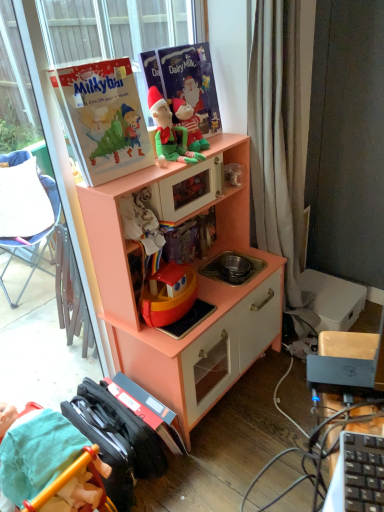
Question: Does matte paper book at upper center, which appears as the 1th paperback book when viewed from the right, lie behind peach wood toy kitchen at center?

Choices:
 (A) yes
 (B) no

Answer: (A)

Question: Is matte paper book at upper center, which is the second paperback book in left-to-right order, smaller than peach wood toy kitchen at center?

Choices:
 (A) yes
 (B) no

Answer: (A)

Question: From the image's perspective, would you say matte paper book at upper center, which is the second paperback book in left-to-right order, is positioned over peach wood toy kitchen at center?

Choices:
 (A) no
 (B) yes

Answer: (B)

Question: From a real-world perspective, is matte paper book at upper center, which is the second paperback book in left-to-right order, under peach wood toy kitchen at center?

Choices:
 (A) no
 (B) yes

Answer: (A)

Question: Considering the relative sizes of matte paper book at upper center, which appears as the 1th paperback book when viewed from the right, and peach wood toy kitchen at center in the image provided, is matte paper book at upper center, which appears as the 1th paperback book when viewed from the right, bigger than peach wood toy kitchen at center?

Choices:
 (A) no
 (B) yes

Answer: (A)

Question: Is point (147, 150) positioned closer to the camera than point (165, 115)?

Choices:
 (A) closer
 (B) farther

Answer: (A)

Question: Is matte paperboard book at upper left, arranged as the 1th paperback book when viewed from the left, wider or thinner than green plush toy at upper center, marked as the 1th person in a right-to-left arrangement?

Choices:
 (A) wide
 (B) thin

Answer: (B)

Question: Is matte paperboard book at upper left, arranged as the 1th paperback book when viewed from the left, taller or shorter than green plush toy at upper center, the 2th person from the bottom?

Choices:
 (A) tall
 (B) short

Answer: (A)

Question: Considering the relative positions of matte paperboard book at upper left, the 2th paperback book from the right, and green plush toy at upper center, which is counted as the second person, starting from the left, in the image provided, is matte paperboard book at upper left, the 2th paperback book from the right, to the left or to the right of green plush toy at upper center, which is counted as the second person, starting from the left,?

Choices:
 (A) right
 (B) left

Answer: (B)

Question: From a real-world perspective, is green plush toy at upper center, marked as the 1th person in a right-to-left arrangement, physically located above or below peach wood toy kitchen at center?

Choices:
 (A) below
 (B) above

Answer: (B)

Question: Looking at the image, does green plush toy at upper center, which is counted as the first person, starting from the top, seem bigger or smaller compared to peach wood toy kitchen at center?

Choices:
 (A) small
 (B) big

Answer: (A)

Question: Considering their positions, is green plush toy at upper center, which is counted as the first person, starting from the top, located in front of or behind peach wood toy kitchen at center?

Choices:
 (A) behind
 (B) front

Answer: (A)

Question: Does point click(x=203, y=157) appear closer or farther from the camera than point click(x=271, y=274)?

Choices:
 (A) farther
 (B) closer

Answer: (B)

Question: Is green plush toy at upper center, the 2th person from the bottom, inside the boundaries of smooth teal fabric at lower left, the 2th person viewed from the right, or outside?

Choices:
 (A) outside
 (B) inside

Answer: (A)

Question: From a real-world perspective, is green plush toy at upper center, the 2th person from the bottom, positioned above or below smooth teal fabric at lower left, the 2th person viewed from the right?

Choices:
 (A) above
 (B) below

Answer: (A)